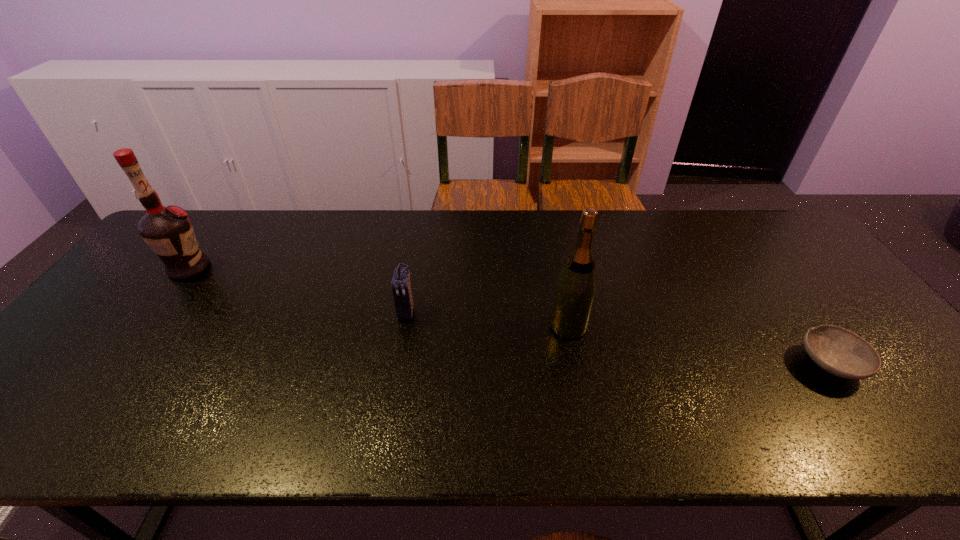
Identify the location of the leftmost object. (168, 231).

The image size is (960, 540). Find the location of `the farthest object`. the farthest object is located at coordinates (168, 231).

Where is `wine bottle`? wine bottle is located at coordinates (575, 290).

You are a GUI agent. You are given a task and a screenshot of the screen. Output one action in this format:
    pyautogui.click(x=<x>, y=<y>)
    Task: Click on the second shortest object
    The height and width of the screenshot is (540, 960).
    Given the screenshot: What is the action you would take?
    pyautogui.click(x=401, y=285)

Where is `the third object from right to left`? the third object from right to left is located at coordinates (401, 285).

Identify the location of bowl. This screenshot has width=960, height=540. (838, 351).

Image resolution: width=960 pixels, height=540 pixels. In order to click on the shortest object in this screenshot , I will do `click(838, 351)`.

Image resolution: width=960 pixels, height=540 pixels. Find the location of `blank space located 0.340m on the front and back of the leftmost object`. blank space located 0.340m on the front and back of the leftmost object is located at coordinates (324, 268).

This screenshot has height=540, width=960. I want to click on free space located on the front-facing side of the wine bottle, so click(411, 326).

Locate an element on the screen. vacant space located 0.320m on the front-facing side of the wine bottle is located at coordinates (427, 326).